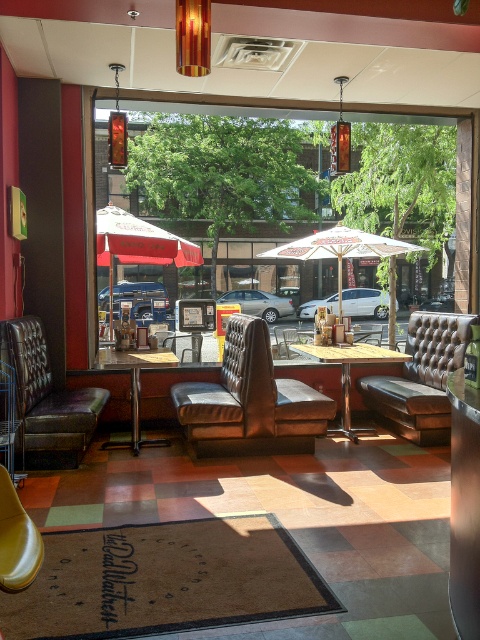
You are a customer sitting at the brown leather couch at left in the diner. You want to get some shade from the sun outside. Can you reach the red fabric umbrella at center to adjust it?

The brown leather couch at left is positioned under the red fabric umbrella at center, so you are already under its shade and do not need to adjust it.

You are standing at the entrance of the diner and want to sit in the brown leather armchair at center. Which direction should you walk to reach it?

Walk towards the center of the diner to reach the brown leather armchair at center.

Looking at this image, you are sitting at the wooden table at center in the diner and want to see the view outside through the large windows. Can you see the brown leather couch at left blocking your view?

The brown leather couch at left is in front of the wooden table at center, so when you are sitting at the wooden table at center, the brown leather couch at left is blocking your view of the windows outside.